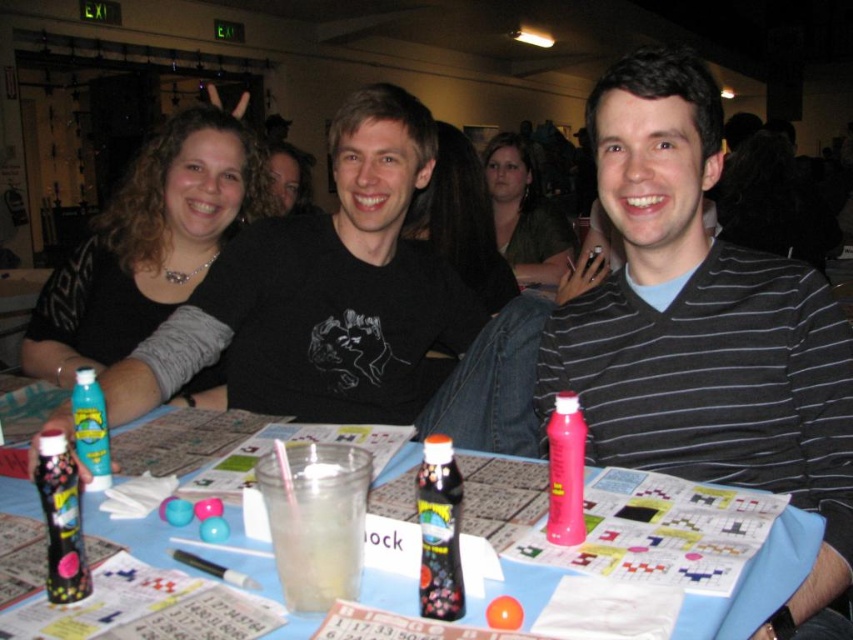
From the picture: You are at a party and want to grab the shiny dark bottle at center to take a drink. However, the matte green shirt at center is blocking your access. Can you reach the bottle without moving the shirt?

The matte green shirt at center is positioned over shiny dark bottle at center, so you cannot reach the bottle without moving the shirt.

You are at a party and need to store both the shiny dark bottle at center and the translucent plastic spray can at table center in a narrow drawer. Which object might have a better chance of fitting through the narrow opening?

The shiny dark bottle at center is thinner than the translucent plastic spray can at table center, so it has a better chance of fitting through the narrow drawer opening.